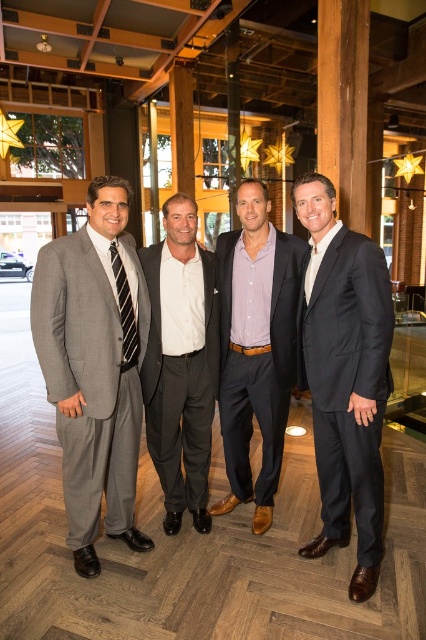
You are at a formal event and need to locate the purple cotton shirt at center. According to the coordinates provided, where exactly is it positioned in the image?

The purple cotton shirt at center is located at coordinates point (256, 348).

You are a photographer at a formal event. You need to capture a photo of the gray wool suit at left and the striped fabric tie at left. Which one is positioned more to the left side?

The gray wool suit at left is more on the left side than the striped fabric tie at left because it is positioned on the left side of the striped fabric tie at left.